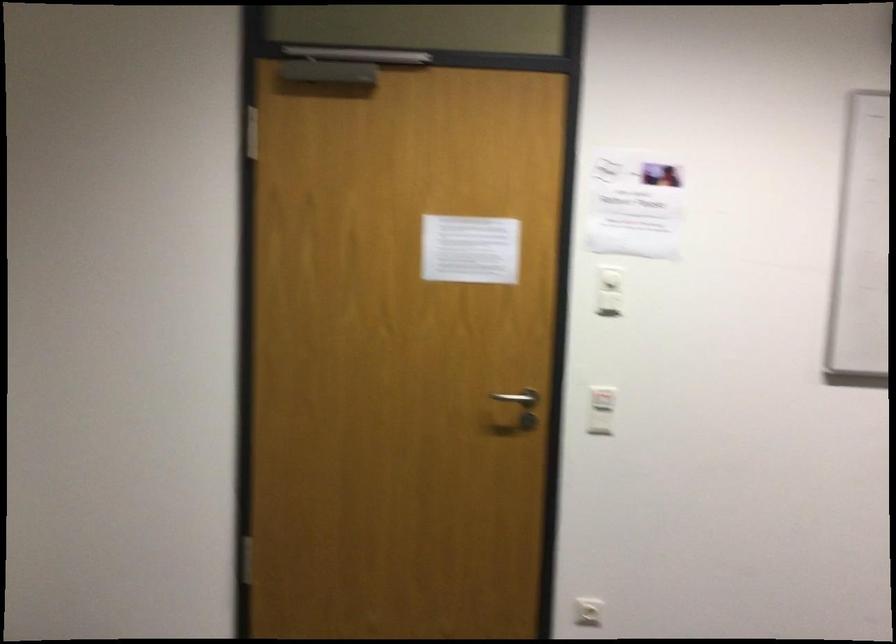
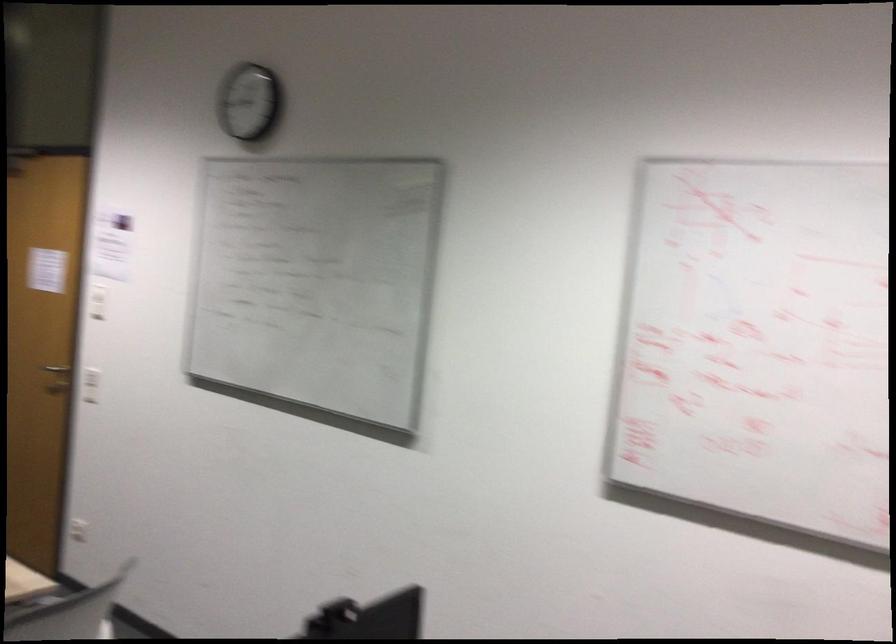
Find the pixel in the second image that matches pixel 517 292 in the first image.

(97, 301)